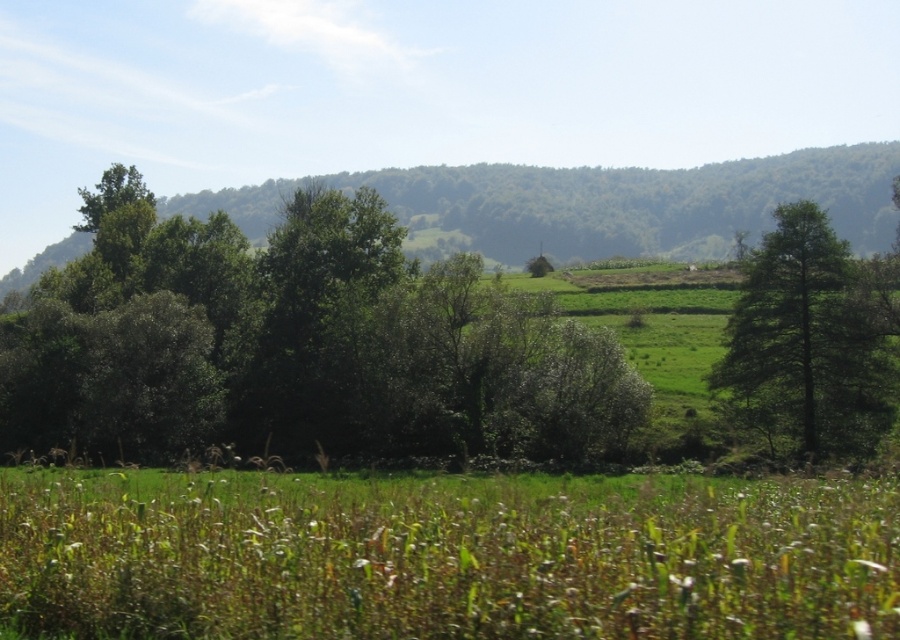
Consider the image. Is green leafy tree at center smaller than green leafy tree at right?

Actually, green leafy tree at center might be larger than green leafy tree at right.

Consider the image. Is green leafy tree at center bigger than green leafy tree at right?

Yes.

Does point (86, 273) lie in front of point (819, 234)?

No, it is not.

Identify the location of green leafy tree at center. This screenshot has width=900, height=640. (297, 342).

Does green grassy pasture at lower center have a lesser height compared to green leafy tree at center?

Correct, green grassy pasture at lower center is not as tall as green leafy tree at center.

Is point (124, 632) behind point (379, 212)?

No, (124, 632) is in front of (379, 212).

Is point (191, 504) positioned in front of point (387, 275)?

That is True.

At what (x,y) coordinates should I click in order to perform the action: click on green grassy pasture at lower center. Please return your answer as a coordinate pair (x, y). The height and width of the screenshot is (640, 900). Looking at the image, I should click on (446, 561).

Identify the location of green grassy pasture at lower center. This screenshot has height=640, width=900. (446, 561).

Is point (634, 522) positioned before point (788, 324)?

Yes, it is.

Which is behind, point (186, 588) or point (813, 410)?

The point (813, 410) is behind.

Where is `green grassy pasture at lower center`? green grassy pasture at lower center is located at coordinates (446, 561).